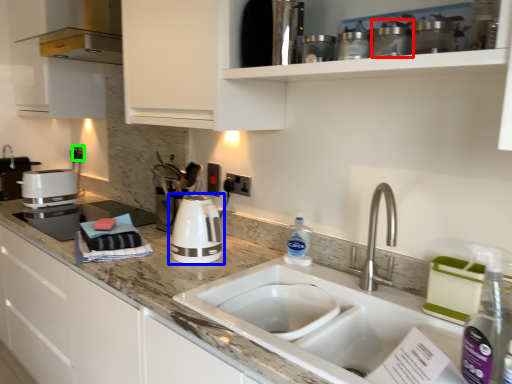
Question: Based on their relative distances, which object is farther from appliance (highlighted by a red box)? Choose from home appliance (highlighted by a blue box) and electric outlet (highlighted by a green box).

Choices:
 (A) home appliance
 (B) electric outlet

Answer: (B)